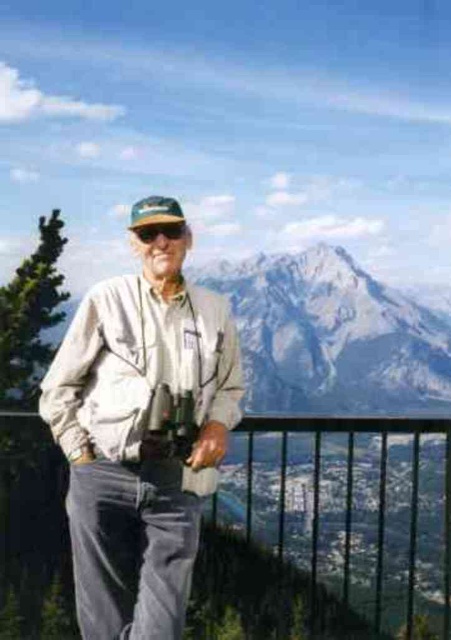
You are a photographer trying to capture the scenic mountain view. You have two items hanging around your neck, the metallic silver binoculars at center and the black matte sunglasses at center. Which item is narrower in width?

The metallic silver binoculars at center is thinner than black matte sunglasses at center, so the metallic silver binoculars at center is narrower in width.

You are standing at the viewpoint and want to take a photo of the mountains. There are two points marked in the image. The first point is at coordinates point (67, 595) and the second is at point (169, 221). Which point should you stand behind to ensure the mountains are fully visible in your photo?

You should stand behind point (169, 221) because point (67, 595) is behind it, so standing behind the second point will keep the first point out of the frame and allow the mountains to be fully visible.